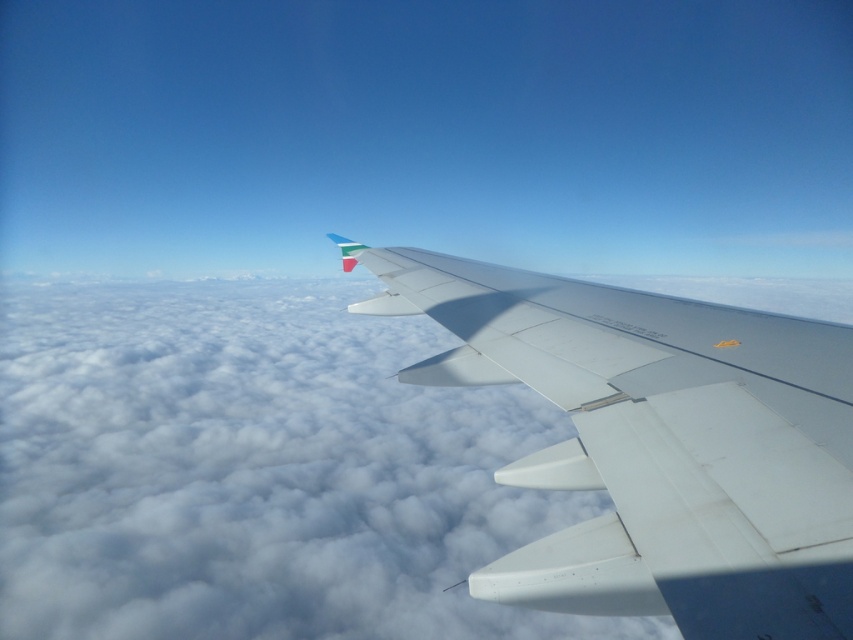
Question: Does white fluffy cloud at upper center have a larger size compared to white matte wing at upper right?

Choices:
 (A) no
 (B) yes

Answer: (B)

Question: Among these objects, which one is farthest from the camera?

Choices:
 (A) white matte wing at upper right
 (B) white fluffy cloud at upper center

Answer: (B)

Question: Which object appears closest to the camera in this image?

Choices:
 (A) white matte wing at upper right
 (B) white fluffy cloud at upper center

Answer: (A)

Question: Can you confirm if white fluffy cloud at upper center is positioned above white matte wing at upper right?

Choices:
 (A) yes
 (B) no

Answer: (B)

Question: Which point appears closest to the camera in this image?

Choices:
 (A) (190, 518)
 (B) (805, 572)

Answer: (B)

Question: Is white fluffy cloud at upper center further to camera compared to white matte wing at upper right?

Choices:
 (A) yes
 (B) no

Answer: (A)